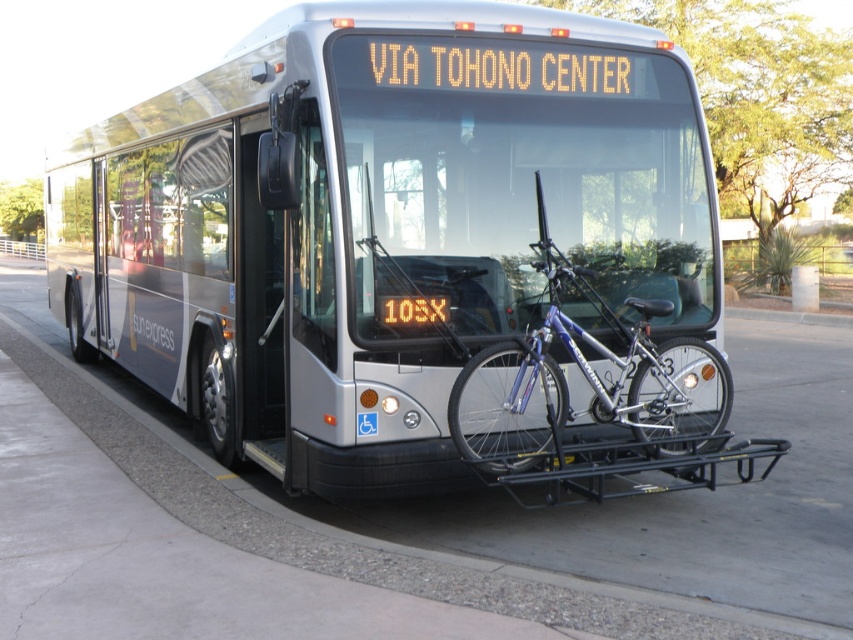
You are standing at the bus stop and want to board the silver metallic bus at center. According to the coordinates provided, where should you position yourself to get on the bus?

The silver metallic bus at center is located at coordinates point (375, 221), so you should position yourself at that point to board the bus.

Based on the photo, you are a delivery person trying to load a package onto a platform that requires the item to be shorter than 2 meters. You have to choose between the silver metallic bus at center and the silver metallic bicycle at center. Which one can you load?

The silver metallic bicycle at center can be loaded because it is shorter than the silver metallic bus at center, which is taller than 2 meters.

You are standing at the bus stop and want to walk to the gray concrete pavement at lower center. Which direction should you move relative to your current position?

You should move towards the lower center direction to reach the gray concrete pavement at lower center.